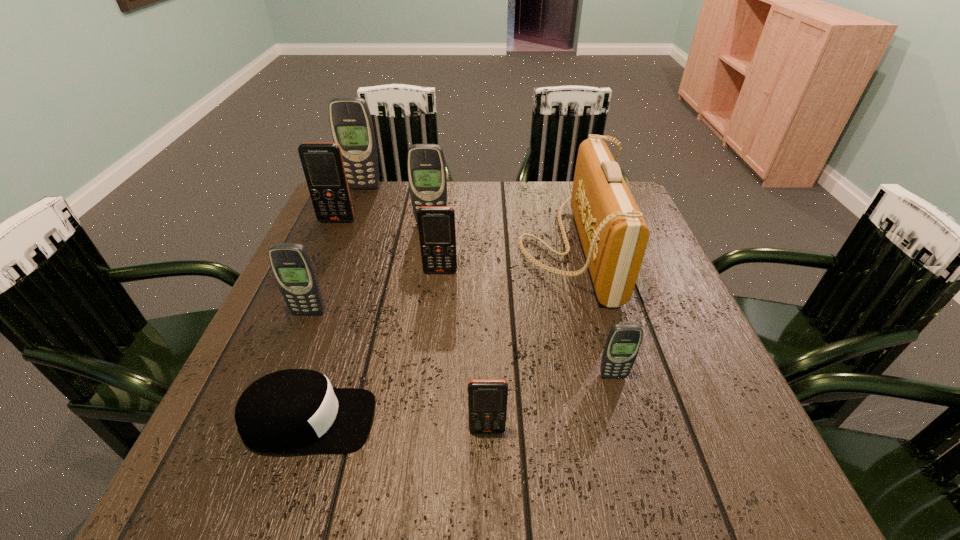
Locate an element on the screen. The width and height of the screenshot is (960, 540). vacant region between the farthest gray cellular telephone and the handbag is located at coordinates (467, 218).

Locate an element on the screen. This screenshot has width=960, height=540. the closest object relative to the leftmost orange cellular telephone is located at coordinates (351, 124).

At what (x,y) coordinates should I click in order to perform the action: click on object that ranks as the third closest to the fourth farthest cellular telephone. Please return your answer as a coordinate pair (x, y). Image resolution: width=960 pixels, height=540 pixels. Looking at the image, I should click on (291, 264).

Identify the location of the fourth closest cellular telephone to the third nearest gray cellular telephone. (291, 264).

I want to click on cellular telephone that stands as the sixth closest to the biggest gray cellular telephone, so click(x=623, y=342).

Select which gray cellular telephone is the fourth closest to the black cap. Please provide its 2D coordinates. Your answer should be formatted as a tuple, i.e. [(x, y)], where the tuple contains the x and y coordinates of a point satisfying the conditions above.

[(351, 124)]

This screenshot has width=960, height=540. I want to click on gray cellular telephone that can be found as the third closest to the rightmost gray cellular telephone, so click(x=351, y=124).

Identify which orange cellular telephone is the closest to the biggest orange cellular telephone. Please provide its 2D coordinates. Your answer should be formatted as a tuple, i.e. [(x, y)], where the tuple contains the x and y coordinates of a point satisfying the conditions above.

[(437, 233)]

Select which orange cellular telephone is the closest to the third farthest gray cellular telephone. Please provide its 2D coordinates. Your answer should be formatted as a tuple, i.e. [(x, y)], where the tuple contains the x and y coordinates of a point satisfying the conditions above.

[(437, 233)]

Identify the location of vacant space that satisfies the following two spatial constraints: 1. on the decorative side of the handbag; 2. on the screen of the third nearest cellular telephone. (587, 313).